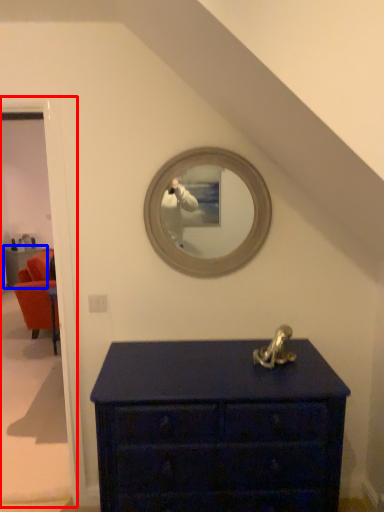
Question: Among these objects, which one is nearest to the camera, door (highlighted by a red box) or furniture (highlighted by a blue box)?

Choices:
 (A) door
 (B) furniture

Answer: (A)